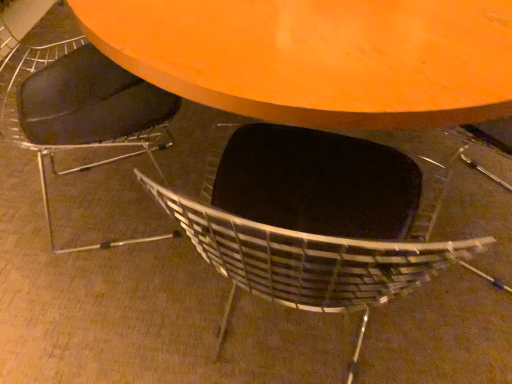
At what (x,y) coordinates should I click in order to perform the action: click on free space to the left of black leather chair at center, the first chair in the right-to-left sequence. Please return your answer as a coordinate pair (x, y). The width and height of the screenshot is (512, 384). Looking at the image, I should click on (143, 309).